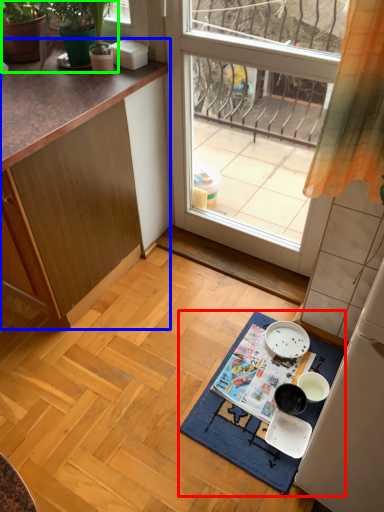
Question: Based on their relative distances, which object is farther from bath mat (highlighted by a red box)? Choose from cabinetry (highlighted by a blue box) and plant (highlighted by a green box).

Choices:
 (A) cabinetry
 (B) plant

Answer: (B)